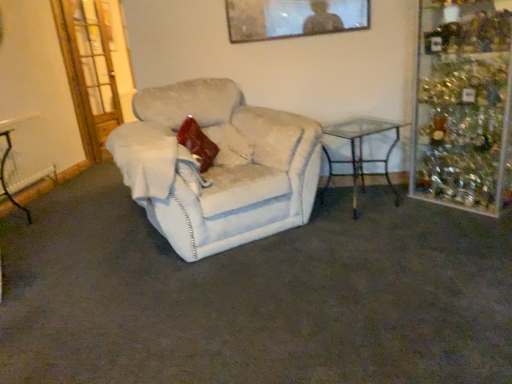
Question: From the image's perspective, is white fabric chair at center below velvet red pillow at center?

Choices:
 (A) no
 (B) yes

Answer: (B)

Question: Can you confirm if white fabric chair at center is shorter than velvet red pillow at center?

Choices:
 (A) yes
 (B) no

Answer: (B)

Question: Could you tell me if white fabric chair at center is facing velvet red pillow at center?

Choices:
 (A) no
 (B) yes

Answer: (B)

Question: Can you confirm if white fabric chair at center is positioned to the right of velvet red pillow at center?

Choices:
 (A) no
 (B) yes

Answer: (B)

Question: Is white fabric chair at center in front of velvet red pillow at center?

Choices:
 (A) yes
 (B) no

Answer: (A)

Question: Is white fabric chair at center touching velvet red pillow at center?

Choices:
 (A) yes
 (B) no

Answer: (B)

Question: Is metallic silver picture frame at upper center with metallic wire table at left, the first table viewed from the left?

Choices:
 (A) no
 (B) yes

Answer: (A)

Question: Are metallic silver picture frame at upper center and metallic wire table at left, the first table viewed from the left, located far from each other?

Choices:
 (A) no
 (B) yes

Answer: (B)

Question: Is metallic silver picture frame at upper center shorter than metallic wire table at left, the first table viewed from the left?

Choices:
 (A) no
 (B) yes

Answer: (B)

Question: Does metallic silver picture frame at upper center have a greater height compared to metallic wire table at left, which is the second table from right to left?

Choices:
 (A) no
 (B) yes

Answer: (A)

Question: Can you confirm if metallic silver picture frame at upper center is positioned to the left of metallic wire table at left, which is the second table from right to left?

Choices:
 (A) yes
 (B) no

Answer: (B)

Question: From the image's perspective, is metallic silver picture frame at upper center on metallic wire table at left, which is the second table from right to left?

Choices:
 (A) no
 (B) yes

Answer: (B)

Question: Considering the relative positions of metallic silver picture frame at upper center and velvet red pillow at center in the image provided, is metallic silver picture frame at upper center to the left of velvet red pillow at center from the viewer's perspective?

Choices:
 (A) no
 (B) yes

Answer: (A)